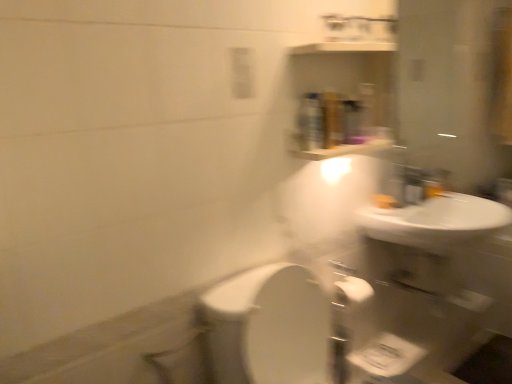
Image resolution: width=512 pixels, height=384 pixels. Identify the location of white glossy sink at upper right. (436, 222).

This screenshot has height=384, width=512. What do you see at coordinates (436, 222) in the screenshot?
I see `white glossy sink at upper right` at bounding box center [436, 222].

What do you see at coordinates (418, 184) in the screenshot? This screenshot has height=384, width=512. I see `matte silver faucet at upper right` at bounding box center [418, 184].

Measure the distance between point (x=420, y=182) and camera.

The depth of point (x=420, y=182) is 1.88 meters.

At what (x,y) coordinates should I click in order to perform the action: click on matte silver faucet at upper right. Please return your answer as a coordinate pair (x, y). This screenshot has height=384, width=512. Looking at the image, I should click on (418, 184).

At what (x,y) coordinates should I click in order to perform the action: click on white glossy sink at upper right. Please return your answer as a coordinate pair (x, y). The width and height of the screenshot is (512, 384). Looking at the image, I should click on (436, 222).

Is white glossy sink at upper right to the right of matte silver faucet at upper right from the viewer's perspective?

Indeed, white glossy sink at upper right is positioned on the right side of matte silver faucet at upper right.

Relative to matte silver faucet at upper right, is white glossy sink at upper right in front or behind?

In the image, white glossy sink at upper right appears in front of matte silver faucet at upper right.

Which is behind, point (473, 220) or point (424, 187)?

The point (424, 187) is farther.

From the image's perspective, relative to matte silver faucet at upper right, is white glossy sink at upper right above or below?

Clearly, from the image's perspective, white glossy sink at upper right is below matte silver faucet at upper right.

From a real-world perspective, is white glossy sink at upper right on matte silver faucet at upper right?

No, from a real-world perspective, white glossy sink at upper right is not on top of matte silver faucet at upper right.

Is white glossy sink at upper right wider than matte silver faucet at upper right?

Indeed, white glossy sink at upper right has a greater width compared to matte silver faucet at upper right.

Does white glossy sink at upper right have a greater height compared to matte silver faucet at upper right?

Indeed, white glossy sink at upper right has a greater height compared to matte silver faucet at upper right.

Considering the sizes of objects white glossy sink at upper right and matte silver faucet at upper right in the image provided, who is bigger, white glossy sink at upper right or matte silver faucet at upper right?

white glossy sink at upper right.

Do you think white glossy sink at upper right is within matte silver faucet at upper right, or outside of it?

white glossy sink at upper right cannot be found inside matte silver faucet at upper right.

Is white glossy sink at upper right not near matte silver faucet at upper right?

No, white glossy sink at upper right is not far from matte silver faucet at upper right.

Could you tell me if white glossy sink at upper right is turned towards matte silver faucet at upper right?

No, white glossy sink at upper right is not turned towards matte silver faucet at upper right.

Can you tell me how much white glossy sink at upper right and matte silver faucet at upper right differ in facing direction?

The facing directions of white glossy sink at upper right and matte silver faucet at upper right are 3.47 degrees apart.

Image resolution: width=512 pixels, height=384 pixels. In order to click on faucet that is behind the white glossy sink at upper right in this screenshot , I will do `click(418, 184)`.

In the image, is matte silver faucet at upper right on the left side or the right side of white glossy sink at upper right?

Based on their positions, matte silver faucet at upper right is located to the left of white glossy sink at upper right.

In the scene shown: Is matte silver faucet at upper right further to the viewer compared to white glossy sink at upper right?

Yes, the depth of matte silver faucet at upper right is greater than that of white glossy sink at upper right.

Is point (426, 196) closer or farther from the camera than point (498, 205)?

Clearly, point (426, 196) is closer to the camera than point (498, 205).

Consider the image. From the image's perspective, is matte silver faucet at upper right positioned above or below white glossy sink at upper right?

matte silver faucet at upper right is above white glossy sink at upper right.

From a real-world perspective, is matte silver faucet at upper right physically located above or below white glossy sink at upper right?

matte silver faucet at upper right is situated higher than white glossy sink at upper right in the real world.

Considering the sizes of matte silver faucet at upper right and white glossy sink at upper right in the image, is matte silver faucet at upper right wider or thinner than white glossy sink at upper right?

matte silver faucet at upper right is thinner than white glossy sink at upper right.

Which of these two, matte silver faucet at upper right or white glossy sink at upper right, stands taller?

Standing taller between the two is white glossy sink at upper right.

Looking at the image, does matte silver faucet at upper right seem bigger or smaller compared to white glossy sink at upper right?

matte silver faucet at upper right is smaller than white glossy sink at upper right.

Would you say matte silver faucet at upper right is inside or outside white glossy sink at upper right?

The correct answer is: outside.

Is matte silver faucet at upper right next to white glossy sink at upper right?

No.

Based on the photo, could you tell me if matte silver faucet at upper right is facing white glossy sink at upper right?

No, matte silver faucet at upper right is not oriented towards white glossy sink at upper right.

What's the angular difference between matte silver faucet at upper right and white glossy sink at upper right's facing directions?

The angular difference between matte silver faucet at upper right and white glossy sink at upper right is 3.47 degrees.

Measure the distance between matte silver faucet at upper right and white glossy sink at upper right.

A distance of 6.45 inches exists between matte silver faucet at upper right and white glossy sink at upper right.

You are a GUI agent. You are given a task and a screenshot of the screen. Output one action in this format:
    pyautogui.click(x=<x>, y=<y>)
    Task: Click on the sink in front of the matte silver faucet at upper right
    This screenshot has height=384, width=512.
    Given the screenshot: What is the action you would take?
    pyautogui.click(x=436, y=222)

Where is `faucet behind the white glossy sink at upper right`? faucet behind the white glossy sink at upper right is located at coordinates (418, 184).

Where is `faucet that is on the left side of white glossy sink at upper right`? The height and width of the screenshot is (384, 512). faucet that is on the left side of white glossy sink at upper right is located at coordinates (418, 184).